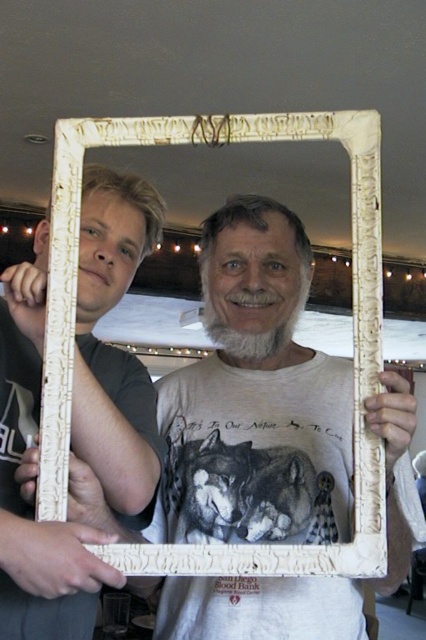
Who is positioned more to the right, matte white frame at left or white wood picture frame at center?

white wood picture frame at center

Which is in front, point (63, 564) or point (282, 134)?

Point (63, 564) is more forward.

Does point (3, 627) come in front of point (373, 244)?

Yes.

The width and height of the screenshot is (426, 640). I want to click on matte white frame at left, so click(x=111, y=346).